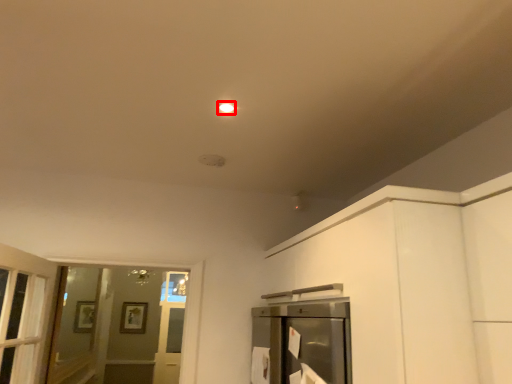
Question: From the image's perspective, where is lighting (annotated by the red box) located in relation to screen door in the image?

Choices:
 (A) above
 (B) below

Answer: (A)